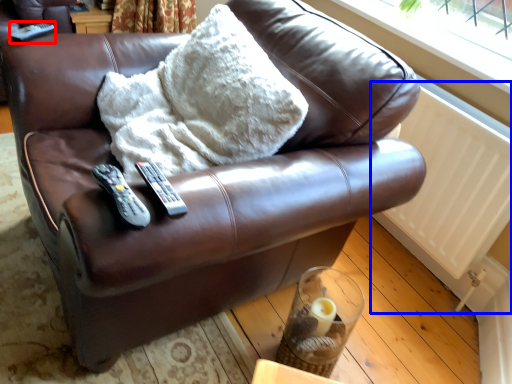
Question: Which of the following is the closest to the observer, remote (highlighted by a red box) or radiator (highlighted by a blue box)?

Choices:
 (A) remote
 (B) radiator

Answer: (B)